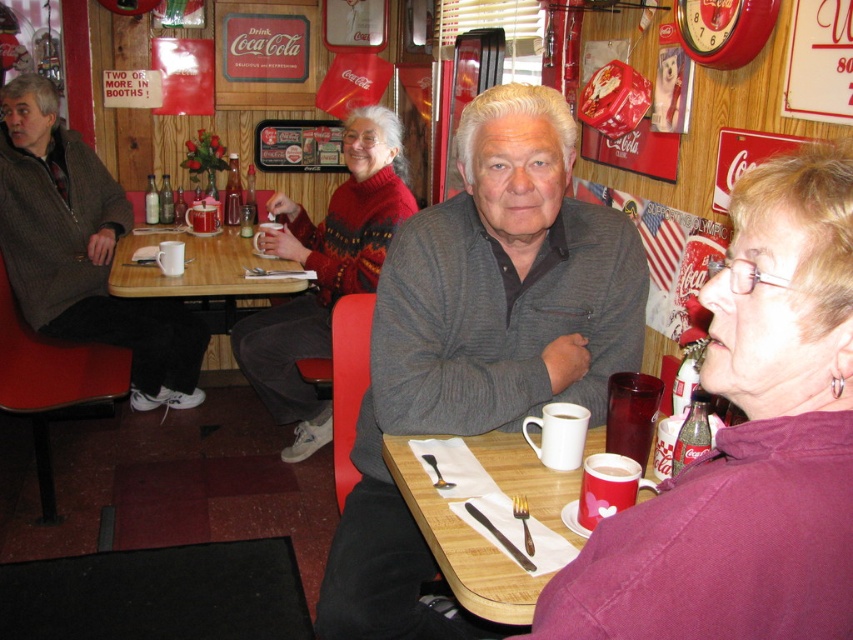
Question: Does purple fabric shirt at upper right appear on the right side of knitted sweater at center?

Choices:
 (A) yes
 (B) no

Answer: (A)

Question: Does gray knit sweater at center appear on the left side of white matte mug at lower center?

Choices:
 (A) yes
 (B) no

Answer: (A)

Question: Is purple fabric shirt at upper right smaller than gray knit sweater at center?

Choices:
 (A) no
 (B) yes

Answer: (B)

Question: Which point is farther from the camera taking this photo?

Choices:
 (A) (4, 252)
 (B) (163, 196)
 (C) (521, 612)

Answer: (B)

Question: Among these points, which one is nearest to the camera?

Choices:
 (A) (149, 177)
 (B) (608, 474)
 (C) (163, 212)

Answer: (B)

Question: Among these objects, which one is nearest to the camera?

Choices:
 (A) brushed metal soda at table center
 (B) wooden table at lower center

Answer: (B)